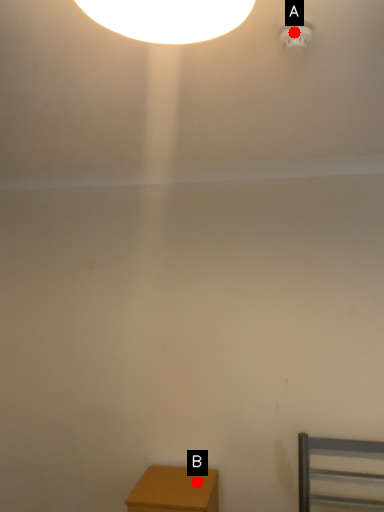
Question: Two points are circled on the image, labeled by A and B beside each circle. Which of the following is the closest to the observer?

Choices:
 (A) A is closer
 (B) B is closer

Answer: (A)